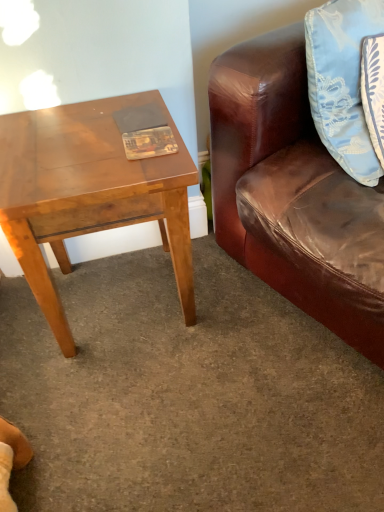
Locate an element on the screen. The height and width of the screenshot is (512, 384). space that is in front of matte plastic book at center is located at coordinates (144, 172).